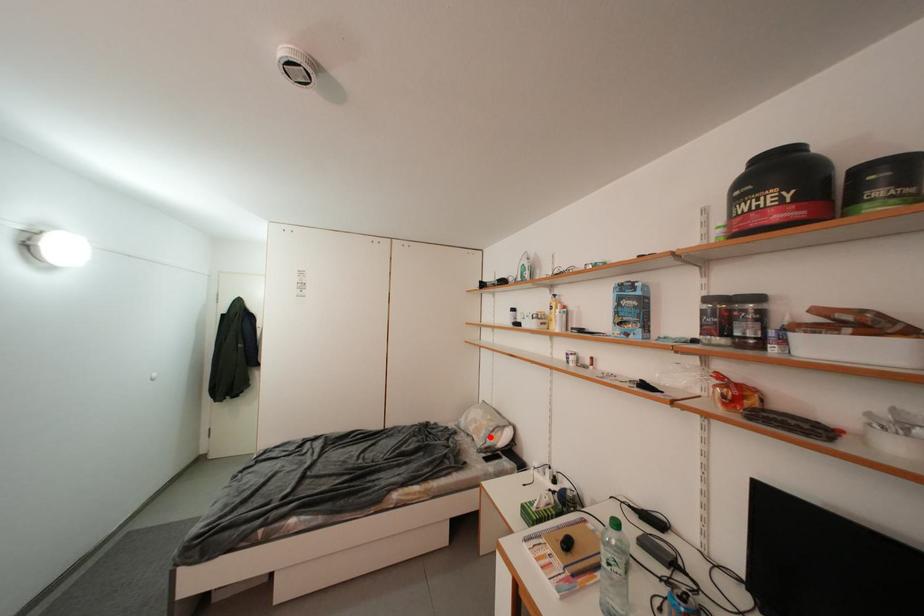
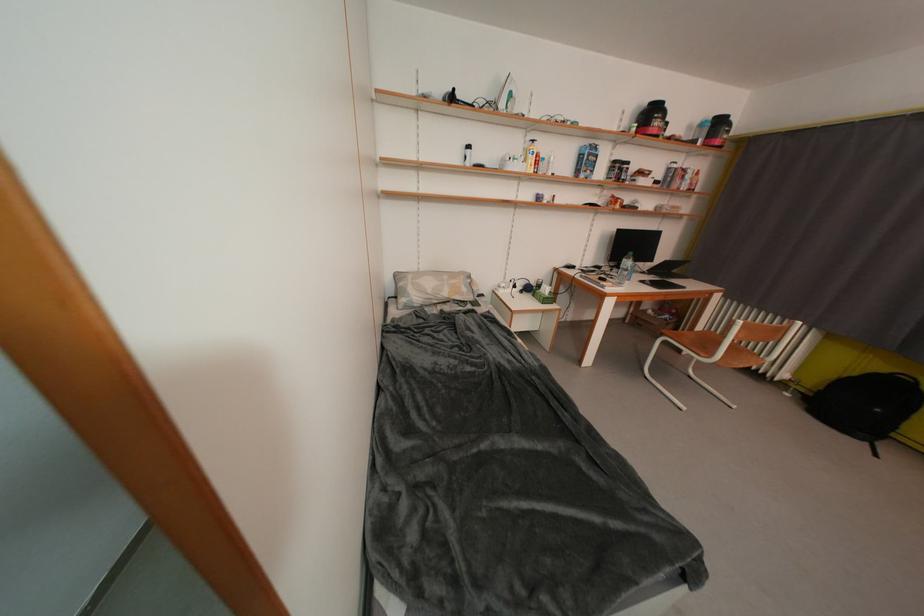
Find the pixel in the second image that matches the highlighted location in the first image.

(471, 293)